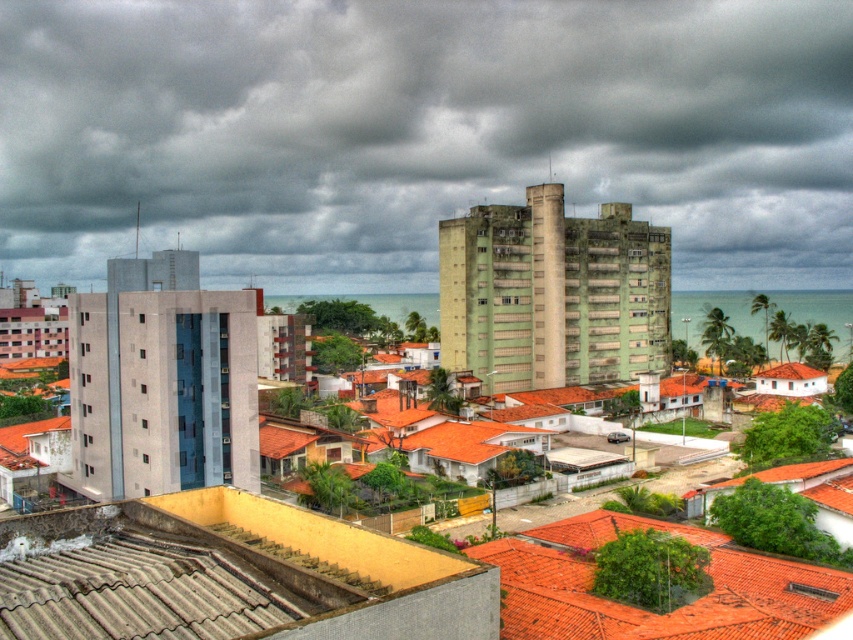
Question: Which of these objects is positioned farthest from the gray cloudy sky at upper center?

Choices:
 (A) gray corrugated metal roof at lower left
 (B) orange tile roof at lower right

Answer: (A)

Question: Which point is closer to the camera?

Choices:
 (A) gray corrugated metal roof at lower left
 (B) orange tile roof at lower right
 (C) gray cloudy sky at upper center

Answer: (A)

Question: Where is gray corrugated metal roof at lower left located in relation to orange tile roof at lower right in the image?

Choices:
 (A) above
 (B) below

Answer: (A)

Question: Is gray corrugated metal roof at lower left thinner than orange tile roof at lower right?

Choices:
 (A) no
 (B) yes

Answer: (B)

Question: Does gray cloudy sky at upper center have a greater width compared to orange tile roof at lower right?

Choices:
 (A) yes
 (B) no

Answer: (A)

Question: Which point appears farthest from the camera in this image?

Choices:
 (A) (590, 544)
 (B) (200, 580)

Answer: (A)